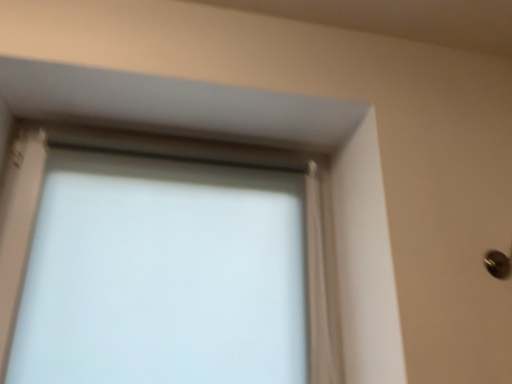
The width and height of the screenshot is (512, 384). I want to click on frosted glass window at upper center, so click(266, 137).

What do you see at coordinates (266, 137) in the screenshot? Image resolution: width=512 pixels, height=384 pixels. I see `frosted glass window at upper center` at bounding box center [266, 137].

Locate an element on the screen. frosted glass window at upper center is located at coordinates (266, 137).